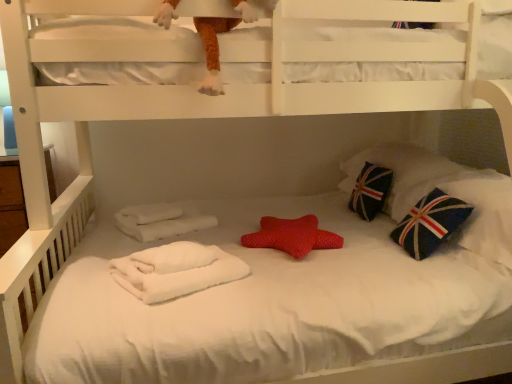
Question: Is the surface of dark blue fabric pillow with union jack design at right, which is counted as the 2th pillow, starting from the back, in direct contact with rubber star at center?

Choices:
 (A) no
 (B) yes

Answer: (A)

Question: Is dark blue fabric pillow with union jack design at right, which is counted as the 2th pillow, starting from the back, not inside rubber star at center?

Choices:
 (A) no
 (B) yes

Answer: (B)

Question: From a real-world perspective, is dark blue fabric pillow with union jack design at right, which is counted as the 2th pillow, starting from the back, on rubber star at center?

Choices:
 (A) yes
 (B) no

Answer: (A)

Question: Is dark blue fabric pillow with union jack design at right, which is counted as the 2th pillow, starting from the back, at the left side of rubber star at center?

Choices:
 (A) no
 (B) yes

Answer: (A)

Question: From the image's perspective, is dark blue fabric pillow with union jack design at right, which is counted as the 2th pillow, starting from the back, over rubber star at center?

Choices:
 (A) yes
 (B) no

Answer: (A)

Question: Would you say rubber star at center is to the left or to the right of fuzzy orange plush at upper center in the picture?

Choices:
 (A) right
 (B) left

Answer: (A)

Question: In terms of size, does rubber star at center appear bigger or smaller than fuzzy orange plush at upper center?

Choices:
 (A) small
 (B) big

Answer: (A)

Question: From a real-world perspective, is rubber star at center above or below fuzzy orange plush at upper center?

Choices:
 (A) below
 (B) above

Answer: (A)

Question: Is rubber star at center inside the boundaries of fuzzy orange plush at upper center, or outside?

Choices:
 (A) outside
 (B) inside

Answer: (A)

Question: From their relative heights in the image, would you say rubber star at center is taller or shorter than dark blue fabric pillow with union jack design at right, the first pillow positioned from the front?

Choices:
 (A) tall
 (B) short

Answer: (B)

Question: Is rubber star at center bigger or smaller than dark blue fabric pillow with union jack design at right, the first pillow positioned from the front?

Choices:
 (A) small
 (B) big

Answer: (A)

Question: Is rubber star at center inside or outside of dark blue fabric pillow with union jack design at right, which is counted as the 2th pillow, starting from the back?

Choices:
 (A) outside
 (B) inside

Answer: (A)

Question: From a real-world perspective, is rubber star at center above or below dark blue fabric pillow with union jack design at right, which is counted as the 2th pillow, starting from the back?

Choices:
 (A) below
 (B) above

Answer: (A)

Question: From a real-world perspective, is rubber star at center physically located above or below blue fabric pillow with union jack design at right, positioned as the 1th pillow in back-to-front order?

Choices:
 (A) below
 (B) above

Answer: (A)

Question: Relative to blue fabric pillow with union jack design at right, marked as the second pillow in a front-to-back arrangement, is rubber star at center in front or behind?

Choices:
 (A) behind
 (B) front

Answer: (B)